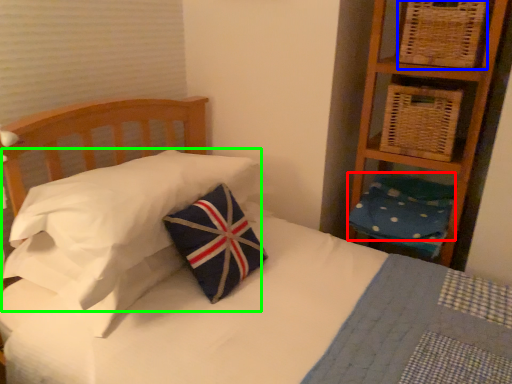
Question: Based on their relative distances, which object is nearer to pillow (highlighted by a red box)? Choose from basket (highlighted by a blue box) and pillow (highlighted by a green box).

Choices:
 (A) basket
 (B) pillow

Answer: (A)